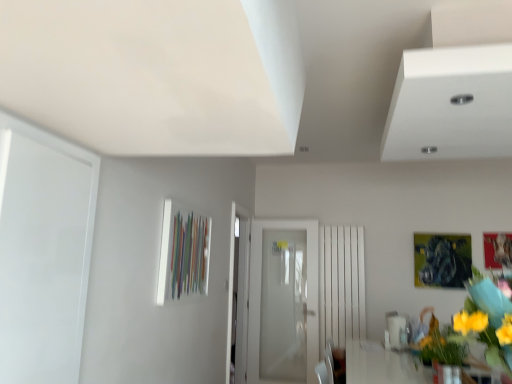
Describe the element at coordinates (260, 293) in the screenshot. This screenshot has width=512, height=384. I see `white frosted glass door at center` at that location.

You are a GUI agent. You are given a task and a screenshot of the screen. Output one action in this format:
    pyautogui.click(x=<x>, y=<y>)
    Task: Click on the white frosted glass door at center
    Image resolution: width=512 pixels, height=384 pixels.
    Given the screenshot: What is the action you would take?
    pyautogui.click(x=260, y=293)

What do you see at coordinates (476, 328) in the screenshot?
I see `yellow fabric flower at right` at bounding box center [476, 328].

You are a GUI agent. You are given a task and a screenshot of the screen. Output one action in this format:
    pyautogui.click(x=<x>, y=<y>)
    Task: Click on the yellow fabric flower at right
    
    Given the screenshot: What is the action you would take?
    pyautogui.click(x=476, y=328)

Where is `white frosted glass door at center`? white frosted glass door at center is located at coordinates (260, 293).

Which is more to the right, yellow fabric flower at right or white frosted glass door at center?

yellow fabric flower at right is more to the right.

Who is more distant, yellow fabric flower at right or white frosted glass door at center?

white frosted glass door at center is further from the camera.

Which is behind, point (485, 334) or point (308, 345)?

Point (308, 345)

From the image's perspective, does yellow fabric flower at right appear lower than white frosted glass door at center?

No, from the image's perspective, yellow fabric flower at right is not below white frosted glass door at center.

Based on the photo, from a real-world perspective, which object stands above the other?

yellow fabric flower at right, from a real-world perspective.

Which object is wider, yellow fabric flower at right or white frosted glass door at center?

Wider between the two is yellow fabric flower at right.

Which of these two, yellow fabric flower at right or white frosted glass door at center, stands taller?

Standing taller between the two is white frosted glass door at center.

Does yellow fabric flower at right have a larger size compared to white frosted glass door at center?

Incorrect, yellow fabric flower at right is not larger than white frosted glass door at center.

Choose the correct answer: Is yellow fabric flower at right inside white frosted glass door at center or outside it?

The correct answer is: outside.

Are yellow fabric flower at right and white frosted glass door at center making contact?

No, yellow fabric flower at right is not with white frosted glass door at center.

Is yellow fabric flower at right facing towards white frosted glass door at center?

No, yellow fabric flower at right does not turn towards white frosted glass door at center.

How many degrees apart are the facing directions of yellow fabric flower at right and white frosted glass door at center?

The angle between the facing direction of yellow fabric flower at right and the facing direction of white frosted glass door at center is 0.226 degrees.

Identify the location of floral arrangement that is in front of the white frosted glass door at center. (476, 328).

Based on the photo, considering the positions of objects white frosted glass door at center and yellow fabric flower at right in the image provided, who is more to the left, white frosted glass door at center or yellow fabric flower at right?

white frosted glass door at center.

Considering the positions of objects white frosted glass door at center and yellow fabric flower at right in the image provided, who is in front, white frosted glass door at center or yellow fabric flower at right?

yellow fabric flower at right is closer to the camera.

Does point (309, 248) come farther from viewer compared to point (428, 348)?

Yes, point (309, 248) is behind point (428, 348).

Based on the photo, from the image's perspective, relative to yellow fabric flower at right, is white frosted glass door at center above or below?

white frosted glass door at center is below yellow fabric flower at right.

From a real-world perspective, who is located higher, white frosted glass door at center or yellow fabric flower at right?

In real-world perspective, yellow fabric flower at right is above.

Considering the relative sizes of white frosted glass door at center and yellow fabric flower at right in the image provided, is white frosted glass door at center wider than yellow fabric flower at right?

No, white frosted glass door at center is not wider than yellow fabric flower at right.

Between white frosted glass door at center and yellow fabric flower at right, which one has more height?

white frosted glass door at center.

Which of these two, white frosted glass door at center or yellow fabric flower at right, is bigger?

white frosted glass door at center.

Which is correct: white frosted glass door at center is inside yellow fabric flower at right, or outside of it?

The correct answer is: outside.

Is white frosted glass door at center beside yellow fabric flower at right?

They are not placed beside each other.

Could you tell me if white frosted glass door at center is facing yellow fabric flower at right?

No, white frosted glass door at center is not turned towards yellow fabric flower at right.

How different are the orientations of white frosted glass door at center and yellow fabric flower at right in degrees?

0.226 degrees separate the facing orientations of white frosted glass door at center and yellow fabric flower at right.

Locate an element on the screen. The height and width of the screenshot is (384, 512). door below the yellow fabric flower at right (from a real-world perspective) is located at coordinates (260, 293).

This screenshot has height=384, width=512. Identify the location of door that appears below the yellow fabric flower at right (from a real-world perspective). (260, 293).

Identify the location of floral arrangement located above the white frosted glass door at center (from a real-world perspective). This screenshot has width=512, height=384. tap(476, 328).